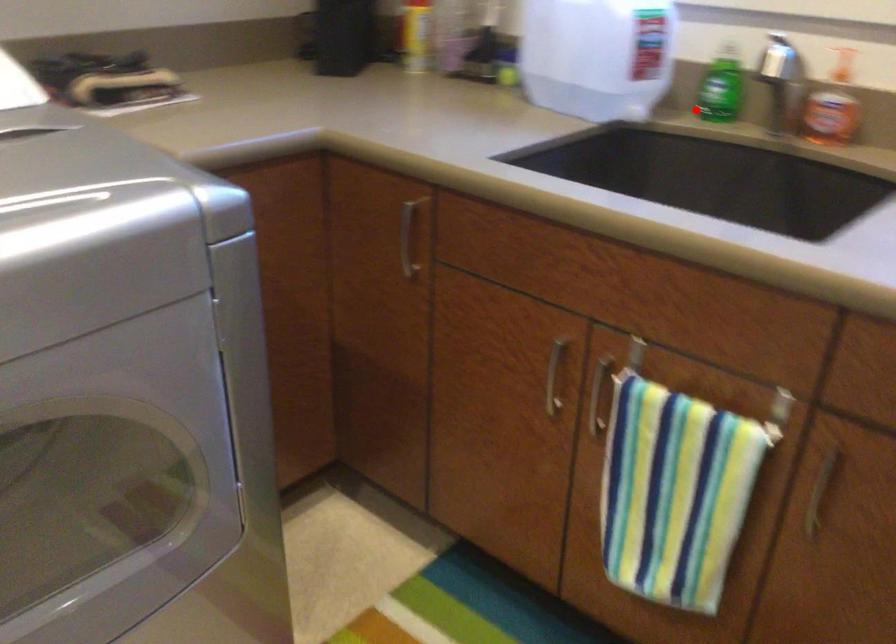
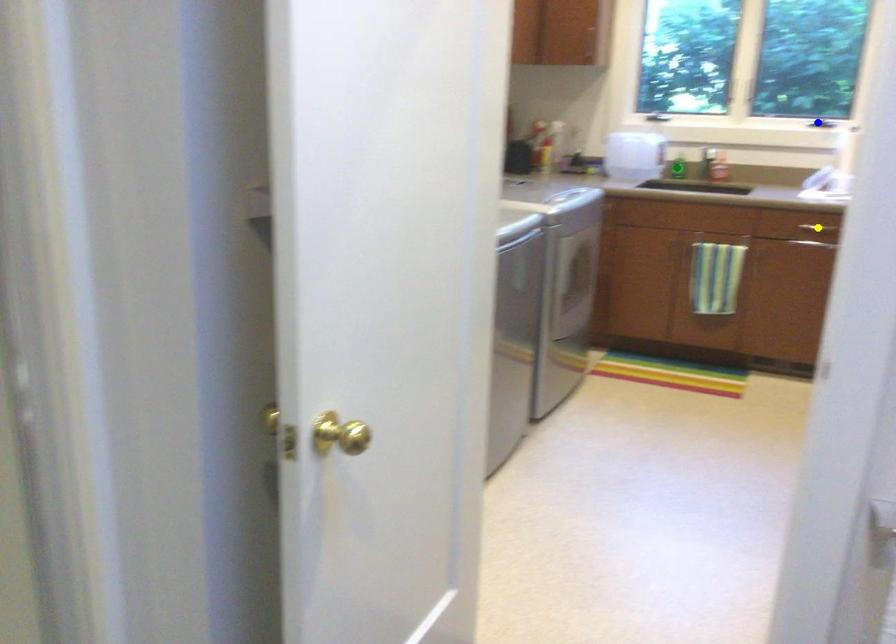
Question: I am providing you with two images of the same scene from different viewpoints. A red point is marked on the first image. You are given multiple points on the second image. In image 2, which mark is for the same physical point as the one in image 1?

Choices:
 (A) blue point
 (B) yellow point
 (C) green point

Answer: (C)